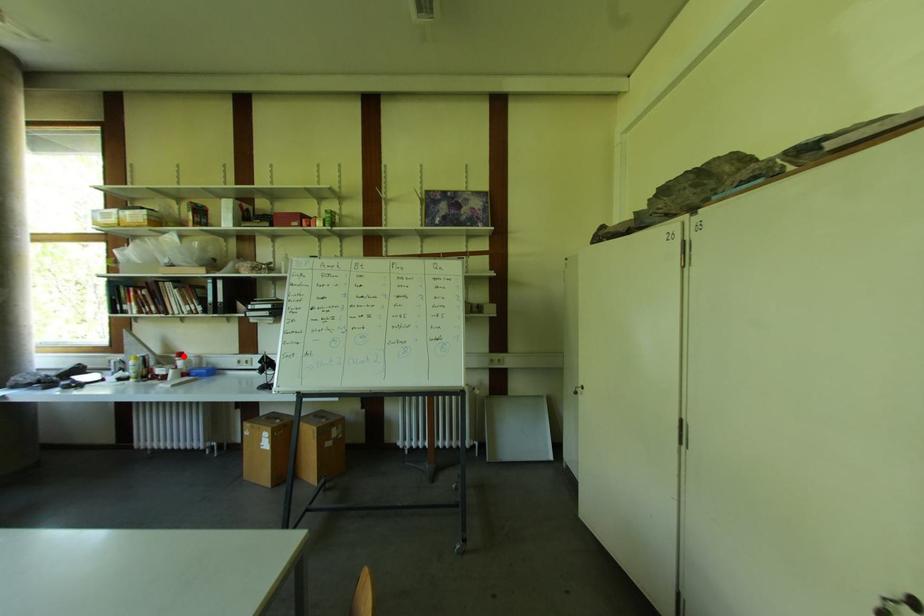
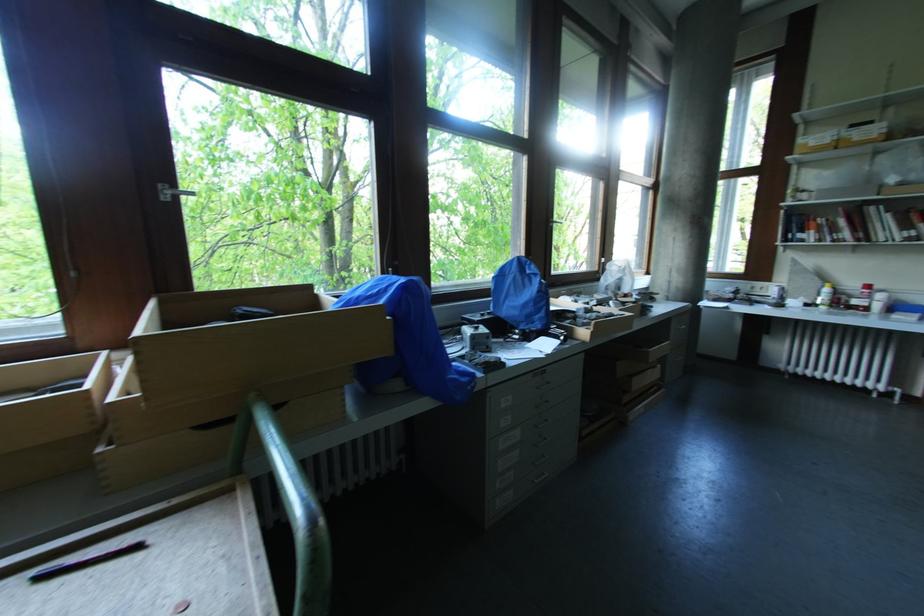
The point at the highlighted location is marked in the first image. Where is the corresponding point in the second image?

(871, 288)